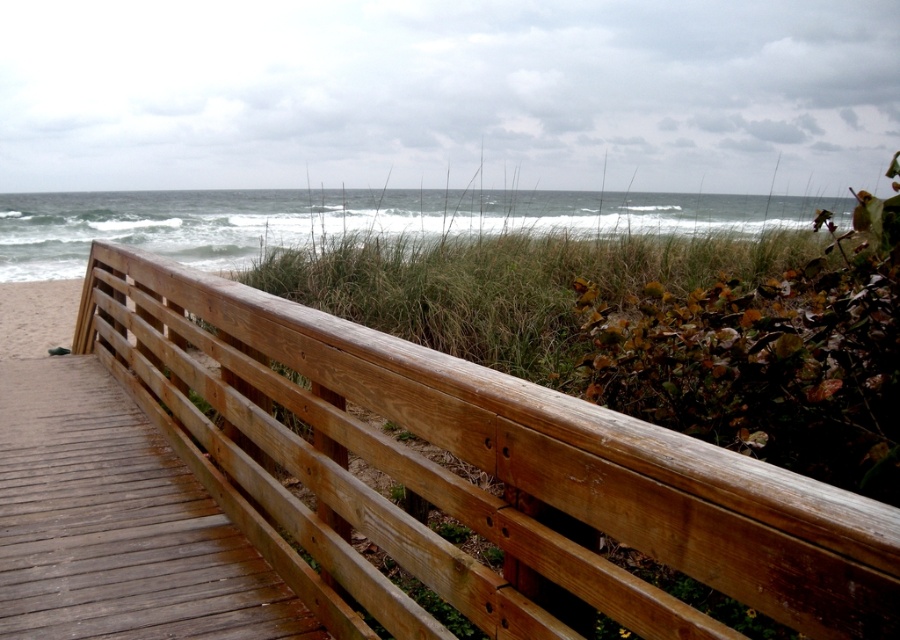
In the scene shown: You are a painter standing on the weathered wood boardwalk at lower left, planning to paint the natural wood rail at center. Since you want to accurately depict their sizes, which object is wider?

The natural wood rail at center is wider than the weathered wood boardwalk at lower left.

You are standing on the weathered wood boardwalk at lower left and want to reach the natural wood rail at center. In which direction should you move relative to your current position?

You should move to the right since the natural wood rail at center is to the right of the weathered wood boardwalk at lower left.

You are standing on the wooden boardwalk and looking at two points marked in the scene. The first point is at coordinates point (684, 486), and the second point is at point (24, 509). Which of these two points is nearer to your current position on the boardwalk?

Point (684, 486) is closer to the camera than point (24, 509), so the first point is nearer to your current position on the boardwalk.